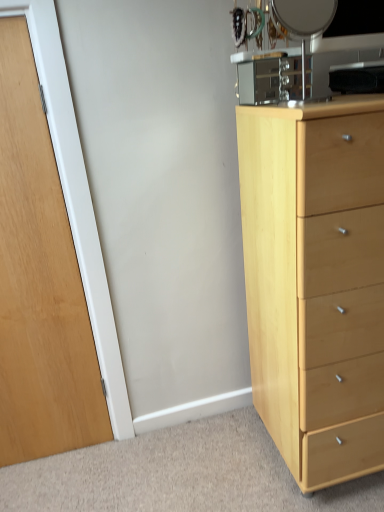
Question: Does metallic silver mirror at upper right have a lesser width compared to wooden door at left?

Choices:
 (A) no
 (B) yes

Answer: (A)

Question: Is the depth of metallic silver mirror at upper right greater than that of wooden door at left?

Choices:
 (A) no
 (B) yes

Answer: (A)

Question: Is metallic silver mirror at upper right shorter than wooden door at left?

Choices:
 (A) no
 (B) yes

Answer: (B)

Question: From the image's perspective, is metallic silver mirror at upper right above wooden door at left?

Choices:
 (A) no
 (B) yes

Answer: (B)

Question: Are metallic silver mirror at upper right and wooden door at left located far from each other?

Choices:
 (A) no
 (B) yes

Answer: (B)

Question: From a real-world perspective, relative to metallic silver mirror at upper right, is light wood chest of drawers at right vertically above or below?

Choices:
 (A) below
 (B) above

Answer: (A)

Question: In the image, is light wood chest of drawers at right positioned in front of or behind metallic silver mirror at upper right?

Choices:
 (A) behind
 (B) front

Answer: (B)

Question: Is light wood chest of drawers at right inside the boundaries of metallic silver mirror at upper right, or outside?

Choices:
 (A) outside
 (B) inside

Answer: (A)

Question: Considering the positions of point (364, 102) and point (291, 18), is point (364, 102) closer or farther from the camera than point (291, 18)?

Choices:
 (A) closer
 (B) farther

Answer: (A)

Question: Considering the positions of point (8, 329) and point (380, 437), is point (8, 329) closer or farther from the camera than point (380, 437)?

Choices:
 (A) farther
 (B) closer

Answer: (A)

Question: Is wooden door at left to the left or to the right of light wood chest of drawers at right in the image?

Choices:
 (A) left
 (B) right

Answer: (A)

Question: In the image, is wooden door at left positioned in front of or behind light wood chest of drawers at right?

Choices:
 (A) behind
 (B) front

Answer: (A)

Question: Considering the positions of wooden door at left and light wood chest of drawers at right in the image, is wooden door at left wider or thinner than light wood chest of drawers at right?

Choices:
 (A) thin
 (B) wide

Answer: (A)

Question: In terms of size, does light wood chest of drawers at right appear bigger or smaller than wooden door at left?

Choices:
 (A) small
 (B) big

Answer: (B)

Question: Considering the positions of point (314, 215) and point (82, 305), is point (314, 215) closer or farther from the camera than point (82, 305)?

Choices:
 (A) farther
 (B) closer

Answer: (B)